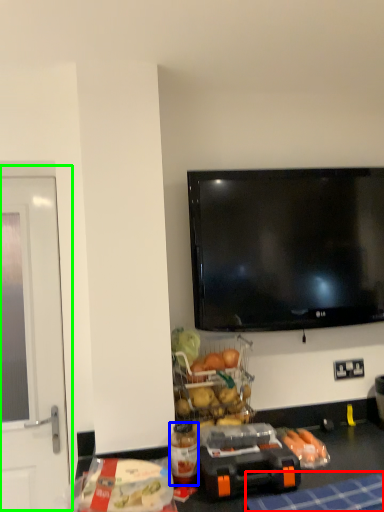
Question: Which object is the farthest from tablecloth (highlighted by a red box)? Choose among these: bottle (highlighted by a blue box) or screen door (highlighted by a green box).

Choices:
 (A) bottle
 (B) screen door

Answer: (B)